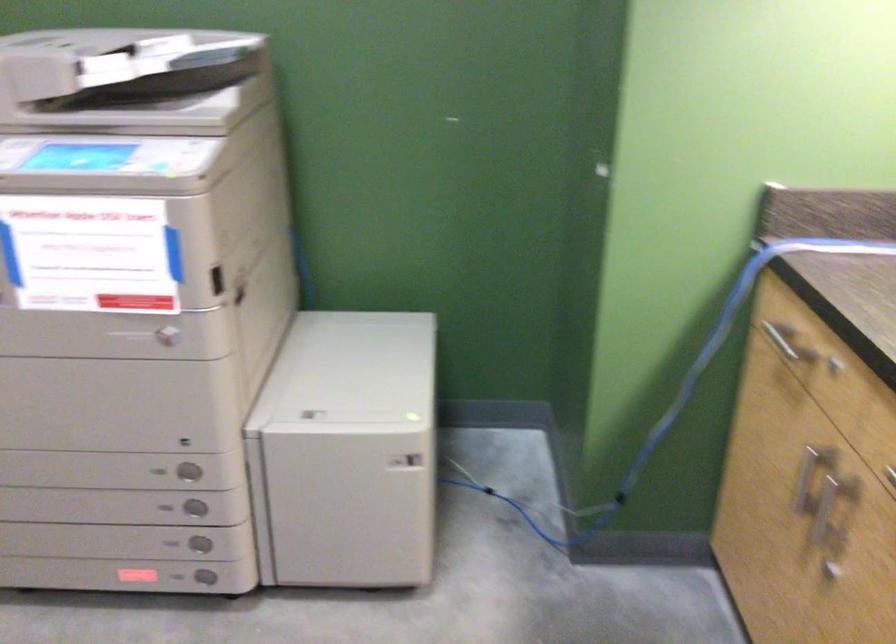
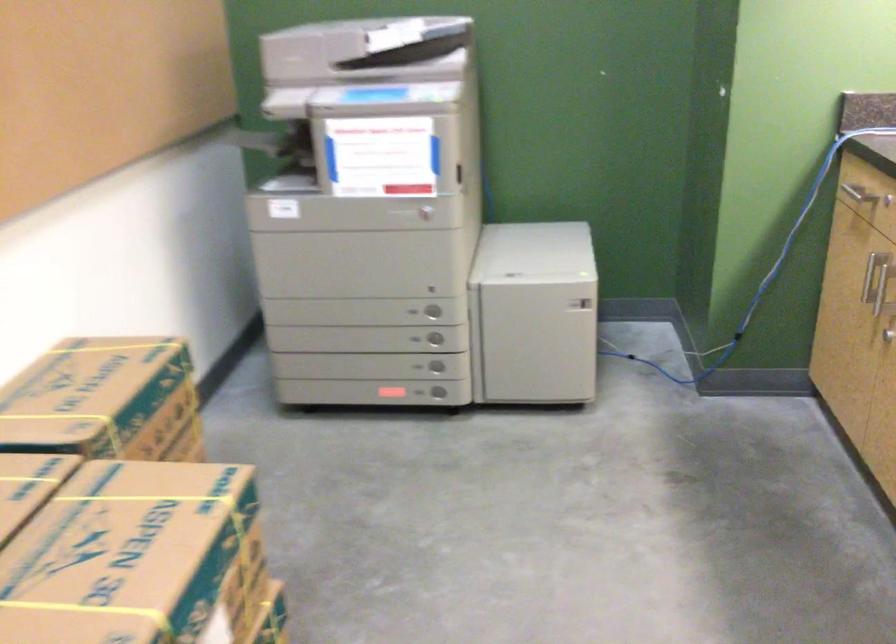
Question: The camera is either moving clockwise (left) or counter-clockwise (right) around the object. The first image is from the beginning of the video and the second image is from the end. Is the camera moving left or right when shooting the video?

Choices:
 (A) Left
 (B) Right

Answer: (B)